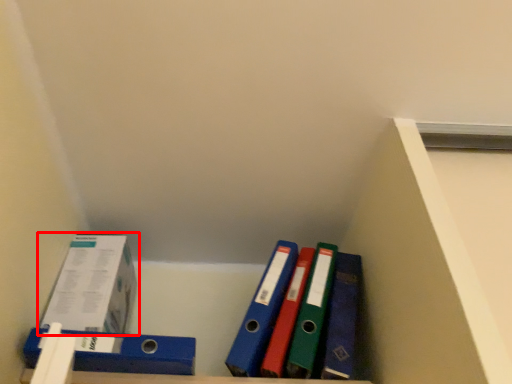
Question: From the image's perspective, where is box (annotated by the red box) located relative to binder?

Choices:
 (A) above
 (B) below

Answer: (A)